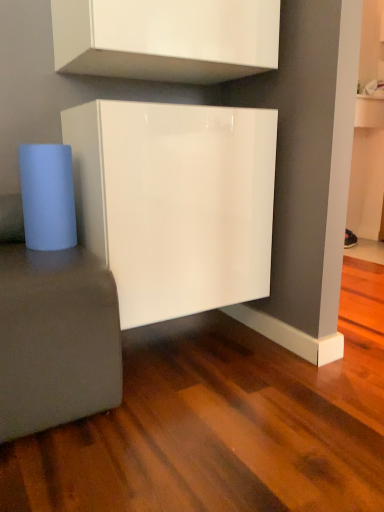
What is the approximate height of glossy white cabinet at upper center, which appears as the first cabinetry when viewed from the top?

glossy white cabinet at upper center, which appears as the first cabinetry when viewed from the top, is 12.82 inches in height.

Where is `glossy white cabinet at upper center, which appears as the first cabinetry when viewed from the top`? Image resolution: width=384 pixels, height=512 pixels. glossy white cabinet at upper center, which appears as the first cabinetry when viewed from the top is located at coordinates (166, 38).

The width and height of the screenshot is (384, 512). Identify the location of matte gray side table at lower left. (56, 339).

Measure the distance between point (116, 390) and camera.

The depth of point (116, 390) is 3.78 feet.

Describe the element at coordinates (175, 202) in the screenshot. I see `glossy white cabinet at center, the second cabinetry in the top-to-bottom sequence` at that location.

The width and height of the screenshot is (384, 512). What are the coordinates of `glossy white cabinet at upper center, which appears as the first cabinetry when viewed from the top` in the screenshot? It's located at (166, 38).

In terms of width, does glossy white cabinet at center, the second cabinetry in the top-to-bottom sequence, look wider or thinner when compared to glossy white cabinet at upper center, which appears as the 2th cabinetry when ordered from the bottom?

Clearly, glossy white cabinet at center, the second cabinetry in the top-to-bottom sequence, has more width compared to glossy white cabinet at upper center, which appears as the 2th cabinetry when ordered from the bottom.

Is glossy white cabinet at upper center, which appears as the first cabinetry when viewed from the top, at the back of glossy white cabinet at center, which is the 1th cabinetry from bottom to top?

That's not correct — glossy white cabinet at center, which is the 1th cabinetry from bottom to top, is not looking away from glossy white cabinet at upper center, which appears as the first cabinetry when viewed from the top.

How many degrees apart are the facing directions of glossy white cabinet at center, the second cabinetry in the top-to-bottom sequence, and glossy white cabinet at upper center, which appears as the first cabinetry when viewed from the top?

0.00021 degrees.

From a real-world perspective, relative to glossy white cabinet at upper center, which appears as the first cabinetry when viewed from the top, is glossy white cabinet at center, the second cabinetry in the top-to-bottom sequence, vertically above or below?

From a real-world perspective, glossy white cabinet at center, the second cabinetry in the top-to-bottom sequence, is physically below glossy white cabinet at upper center, which appears as the first cabinetry when viewed from the top.

From the picture: From the image's perspective, is glossy white cabinet at center, the second cabinetry in the top-to-bottom sequence, below matte gray side table at lower left?

Actually, glossy white cabinet at center, the second cabinetry in the top-to-bottom sequence, appears above matte gray side table at lower left in the image.

Which is behind, glossy white cabinet at center, which is the 1th cabinetry from bottom to top, or matte gray side table at lower left?

Positioned behind is glossy white cabinet at center, which is the 1th cabinetry from bottom to top.

From a real-world perspective, is glossy white cabinet at center, which is the 1th cabinetry from bottom to top, above or below matte gray side table at lower left?

Clearly, from a real-world perspective, glossy white cabinet at center, which is the 1th cabinetry from bottom to top, is above matte gray side table at lower left.

Considering the sizes of objects glossy white cabinet at center, the second cabinetry in the top-to-bottom sequence, and matte gray side table at lower left in the image provided, who is bigger, glossy white cabinet at center, the second cabinetry in the top-to-bottom sequence, or matte gray side table at lower left?

Bigger between the two is glossy white cabinet at center, the second cabinetry in the top-to-bottom sequence.

Considering the sizes of objects glossy white cabinet at upper center, which appears as the 2th cabinetry when ordered from the bottom, and matte gray side table at lower left in the image provided, who is wider, glossy white cabinet at upper center, which appears as the 2th cabinetry when ordered from the bottom, or matte gray side table at lower left?

With larger width is matte gray side table at lower left.

From the image's perspective, is glossy white cabinet at upper center, which appears as the first cabinetry when viewed from the top, beneath matte gray side table at lower left?

No.

Considering the points (202, 16) and (18, 256), which point is behind, point (202, 16) or point (18, 256)?

The point (202, 16) is behind.

From the picture: Which of these two, glossy white cabinet at upper center, which appears as the first cabinetry when viewed from the top, or matte gray side table at lower left, stands taller?

matte gray side table at lower left is taller.

Could you tell me if matte gray side table at lower left is facing glossy white cabinet at center, the second cabinetry in the top-to-bottom sequence?

No, matte gray side table at lower left is not aimed at glossy white cabinet at center, the second cabinetry in the top-to-bottom sequence.

Between matte gray side table at lower left and glossy white cabinet at center, which is the 1th cabinetry from bottom to top, which one has larger width?

Wider between the two is matte gray side table at lower left.

Considering their positions, is matte gray side table at lower left located in front of or behind glossy white cabinet at center, the second cabinetry in the top-to-bottom sequence?

In the image, matte gray side table at lower left appears in front of glossy white cabinet at center, the second cabinetry in the top-to-bottom sequence.

Where is `furniture in front of the glossy white cabinet at upper center, which appears as the 2th cabinetry when ordered from the bottom`? Image resolution: width=384 pixels, height=512 pixels. furniture in front of the glossy white cabinet at upper center, which appears as the 2th cabinetry when ordered from the bottom is located at coordinates (56, 339).

What's the angular difference between matte gray side table at lower left and glossy white cabinet at upper center, which appears as the 2th cabinetry when ordered from the bottom,'s facing directions?

The facing directions of matte gray side table at lower left and glossy white cabinet at upper center, which appears as the 2th cabinetry when ordered from the bottom, are 0.000192 degrees apart.

Considering the positions of point (42, 348) and point (169, 28), is point (42, 348) closer or farther from the camera than point (169, 28)?

Point (42, 348) appears to be closer to the viewer than point (169, 28).

Can you confirm if matte gray side table at lower left is taller than glossy white cabinet at upper center, which appears as the 2th cabinetry when ordered from the bottom?

Indeed, matte gray side table at lower left has a greater height compared to glossy white cabinet at upper center, which appears as the 2th cabinetry when ordered from the bottom.

Looking at their sizes, would you say glossy white cabinet at upper center, which appears as the first cabinetry when viewed from the top, is wider or thinner than glossy white cabinet at center, the second cabinetry in the top-to-bottom sequence?

In the image, glossy white cabinet at upper center, which appears as the first cabinetry when viewed from the top, appears to be more narrow than glossy white cabinet at center, the second cabinetry in the top-to-bottom sequence.

Measure the distance between glossy white cabinet at upper center, which appears as the first cabinetry when viewed from the top, and glossy white cabinet at center, the second cabinetry in the top-to-bottom sequence.

glossy white cabinet at upper center, which appears as the first cabinetry when viewed from the top, is 13.41 inches away from glossy white cabinet at center, the second cabinetry in the top-to-bottom sequence.

Looking at the image, does glossy white cabinet at upper center, which appears as the first cabinetry when viewed from the top, seem bigger or smaller compared to glossy white cabinet at center, the second cabinetry in the top-to-bottom sequence?

In the image, glossy white cabinet at upper center, which appears as the first cabinetry when viewed from the top, appears to be smaller than glossy white cabinet at center, the second cabinetry in the top-to-bottom sequence.

Considering the positions of points (217, 9) and (81, 220), is point (217, 9) farther from camera compared to point (81, 220)?

No, it is not.

The width and height of the screenshot is (384, 512). What are the coordinates of `cabinetry that appears behind the glossy white cabinet at upper center, which appears as the 2th cabinetry when ordered from the bottom` in the screenshot? It's located at point(175,202).

This screenshot has width=384, height=512. I want to click on furniture below the glossy white cabinet at center, the second cabinetry in the top-to-bottom sequence (from the image's perspective), so click(x=56, y=339).

When comparing their distances from matte gray side table at lower left, does glossy white cabinet at center, the second cabinetry in the top-to-bottom sequence, or glossy white cabinet at upper center, which appears as the first cabinetry when viewed from the top, seem closer?

glossy white cabinet at center, the second cabinetry in the top-to-bottom sequence, is positioned closer to the anchor matte gray side table at lower left.

Based on their spatial positions, is matte gray side table at lower left or glossy white cabinet at upper center, which appears as the first cabinetry when viewed from the top, further from glossy white cabinet at center, the second cabinetry in the top-to-bottom sequence?

glossy white cabinet at upper center, which appears as the first cabinetry when viewed from the top.

Which object lies nearer to the anchor point glossy white cabinet at upper center, which appears as the first cabinetry when viewed from the top, glossy white cabinet at center, which is the 1th cabinetry from bottom to top, or matte gray side table at lower left?

glossy white cabinet at center, which is the 1th cabinetry from bottom to top, is positioned closer to the anchor glossy white cabinet at upper center, which appears as the first cabinetry when viewed from the top.

Which object lies further to the anchor point matte gray side table at lower left, glossy white cabinet at upper center, which appears as the 2th cabinetry when ordered from the bottom, or glossy white cabinet at center, the second cabinetry in the top-to-bottom sequence?

The object further to matte gray side table at lower left is glossy white cabinet at upper center, which appears as the 2th cabinetry when ordered from the bottom.

Looking at the image, which one is located closer to glossy white cabinet at center, the second cabinetry in the top-to-bottom sequence, glossy white cabinet at upper center, which appears as the 2th cabinetry when ordered from the bottom, or matte gray side table at lower left?

matte gray side table at lower left is positioned closer to the anchor glossy white cabinet at center, the second cabinetry in the top-to-bottom sequence.

Looking at the image, which one is located closer to glossy white cabinet at upper center, which appears as the 2th cabinetry when ordered from the bottom, matte gray side table at lower left or glossy white cabinet at center, the second cabinetry in the top-to-bottom sequence?

The object closer to glossy white cabinet at upper center, which appears as the 2th cabinetry when ordered from the bottom, is glossy white cabinet at center, the second cabinetry in the top-to-bottom sequence.

Find the location of a particular element. cabinetry between glossy white cabinet at upper center, which appears as the first cabinetry when viewed from the top, and matte gray side table at lower left in the up-down direction is located at coordinates (175, 202).